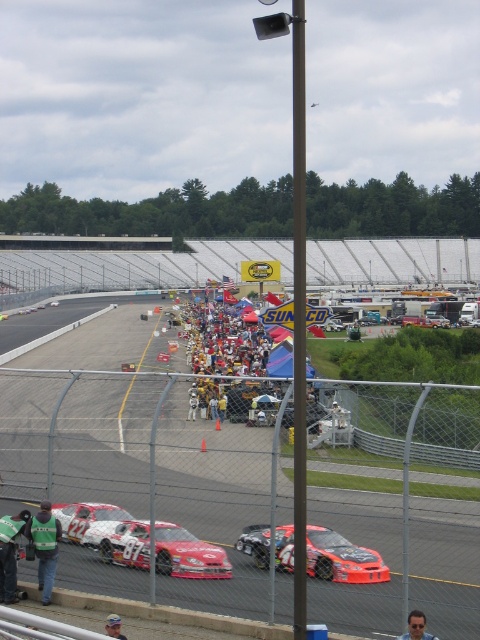
You are a drone operator trying to capture aerial footage of the racetrack. You have two points marked on your screen for camera positioning. The first point is at coordinate point(200, 365) and the second at point(428, 636). Which point should you choose to ensure the camera is positioned behind the other point to avoid obstruction?

Point(200, 365) is behind point(428, 636), so choosing point(200, 365) will position the camera behind point(428, 636), avoiding obstruction.